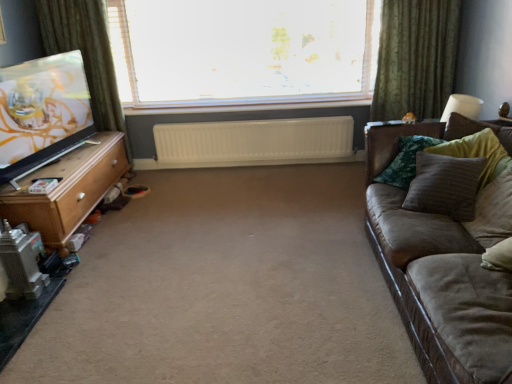
Question: Is white plastic radiator at center spatially inside transparent glass window at center, or outside of it?

Choices:
 (A) inside
 (B) outside

Answer: (B)

Question: Does point (344, 147) appear closer or farther from the camera than point (313, 91)?

Choices:
 (A) closer
 (B) farther

Answer: (A)

Question: Which object is the farthest from the brown textured pillow at right, acting as the second pillow starting from the front?

Choices:
 (A) velvet green pillow at right, arranged as the first pillow when viewed from the back
 (B) light brown wood tv stand at left
 (C) textured brown pillow at right, which appears as the 2th pillow when viewed from the back
 (D) white plastic radiator at center
 (E) suede brown couch at right

Answer: (B)

Question: Estimate the real-world distances between objects in this image. Which object is closer to the green fabric curtain at left, the first curtain in the left-to-right sequence?

Choices:
 (A) suede brown couch at right
 (B) beige carpet at center
 (C) textured brown pillow at right, which appears as the 2th pillow when viewed from the back
 (D) green textured curtain at upper right, which is the second curtain in left-to-right order
 (E) velvet green pillow at right, arranged as the first pillow when viewed from the back

Answer: (B)